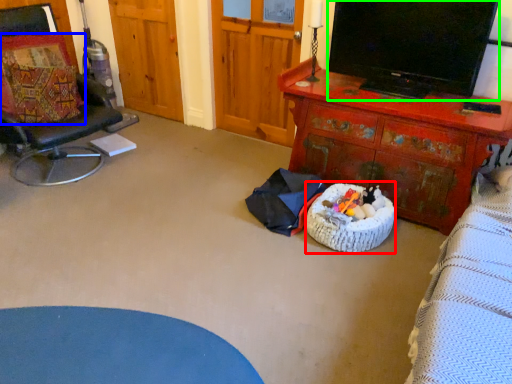
Question: Considering the real-world distances, which object is closest to infant bed (highlighted by a red box)? pillow (highlighted by a blue box) or television (highlighted by a green box).

Choices:
 (A) pillow
 (B) television

Answer: (B)